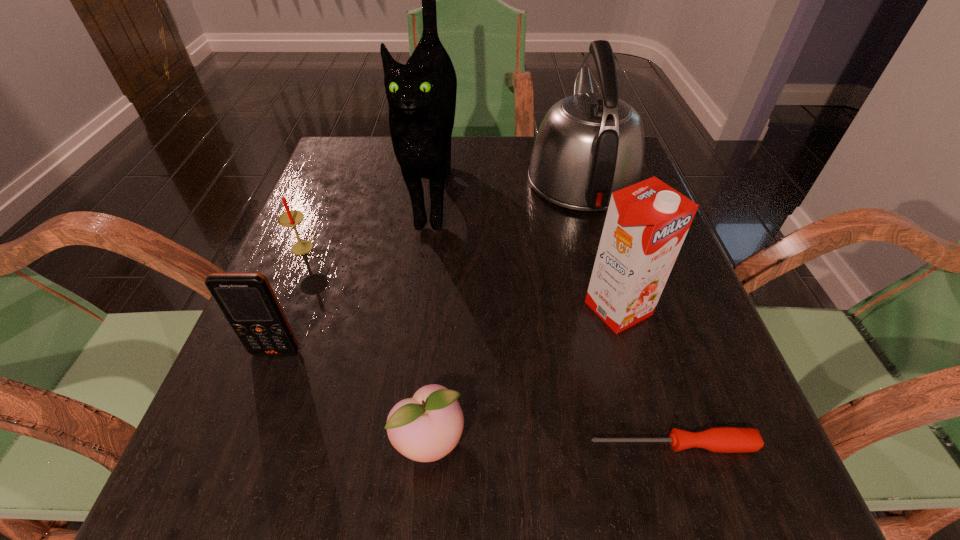
Where is `the tallest object`? This screenshot has width=960, height=540. the tallest object is located at coordinates (421, 95).

Image resolution: width=960 pixels, height=540 pixels. Find the location of `the second tallest object`. the second tallest object is located at coordinates (589, 145).

Where is `carton`? Image resolution: width=960 pixels, height=540 pixels. carton is located at coordinates (646, 224).

Identify the location of the fourth nearest object. (646, 224).

Where is `the third nearest object`? the third nearest object is located at coordinates (247, 300).

Locate an element on the screen. Image resolution: width=960 pixels, height=540 pixels. cellular telephone is located at coordinates (247, 300).

Locate an element on the screen. The height and width of the screenshot is (540, 960). candle is located at coordinates pos(292,218).

The width and height of the screenshot is (960, 540). In order to click on peach in this screenshot , I will do `click(425, 428)`.

This screenshot has width=960, height=540. I want to click on the shortest object, so click(x=720, y=439).

At what (x,y) coordinates should I click in order to perform the action: click on vacant space located 0.360m on the face of the cat. Please return your answer as a coordinate pair (x, y). The width and height of the screenshot is (960, 540). Looking at the image, I should click on (403, 436).